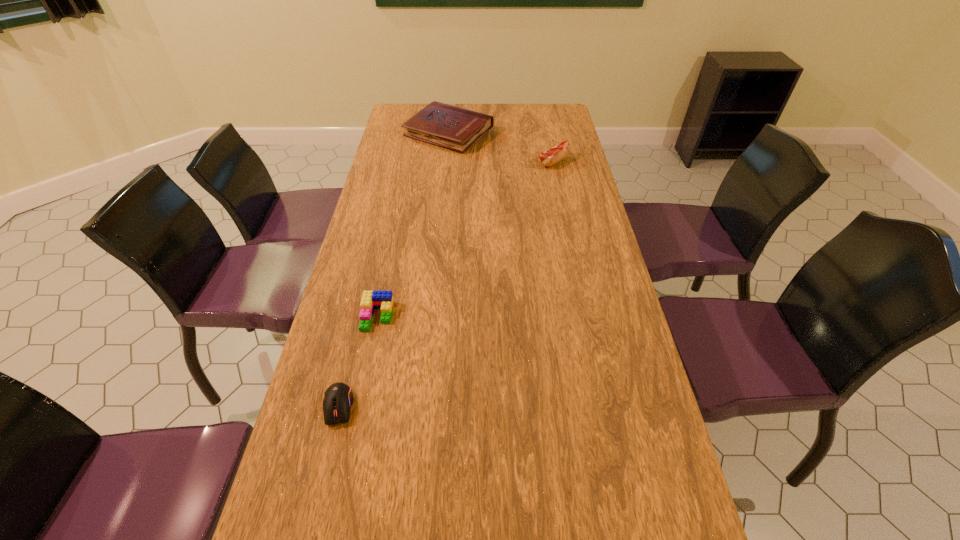
Locate an element on the screen. The height and width of the screenshot is (540, 960). hardback book is located at coordinates (451, 127).

Find the location of `the rightmost object`. the rightmost object is located at coordinates (560, 151).

The width and height of the screenshot is (960, 540). What are the coordinates of `the second shortest object` in the screenshot? It's located at (371, 300).

This screenshot has width=960, height=540. I want to click on the third farthest object, so pyautogui.click(x=371, y=300).

What are the coordinates of `the shortest object` in the screenshot? It's located at (338, 398).

In order to click on the nearest object in this screenshot , I will do `click(338, 398)`.

I want to click on vacant space located 0.060m on the back of the hardback book, so click(x=451, y=107).

You are a GUI agent. You are given a task and a screenshot of the screen. Output one action in this format:
    pyautogui.click(x=<x>, y=<y>)
    Task: Click on the free space located on the left of the sausage
    
    Given the screenshot: What is the action you would take?
    pyautogui.click(x=467, y=162)

Image resolution: width=960 pixels, height=540 pixels. Find the location of `free spot located on the right of the second nearest object`. free spot located on the right of the second nearest object is located at coordinates (505, 316).

Locate an element on the screen. free point located on the back of the computer mouse is located at coordinates (369, 280).